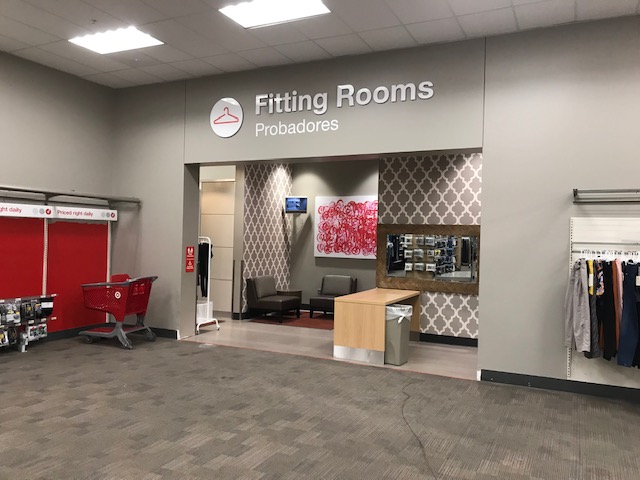
Find the location of a particular element. This screenshot has height=480, width=640. bin is located at coordinates (396, 323).